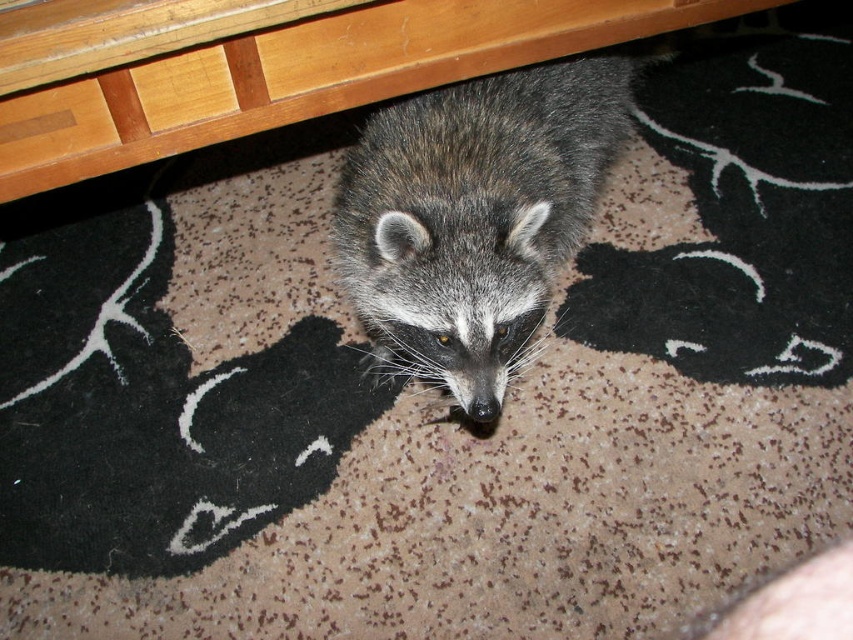
Question: Which object appears farthest from the camera in this image?

Choices:
 (A) wooden drawer at upper center
 (B) wooden drawer at upper left

Answer: (A)

Question: Based on their relative distances, which object is nearer to the fuzzy gray raccoon at center?

Choices:
 (A) wooden drawer at upper left
 (B) wooden table at upper center

Answer: (B)

Question: Can you confirm if wooden drawer at upper left is bigger than wooden drawer at upper center?

Choices:
 (A) yes
 (B) no

Answer: (A)

Question: Considering the relative positions of wooden table at upper center and wooden drawer at upper center in the image provided, where is wooden table at upper center located with respect to wooden drawer at upper center?

Choices:
 (A) below
 (B) above

Answer: (B)

Question: Is wooden table at upper center above wooden drawer at upper center?

Choices:
 (A) no
 (B) yes

Answer: (B)

Question: Which object is the farthest from the wooden drawer at upper left?

Choices:
 (A) fuzzy gray raccoon at center
 (B) wooden table at upper center
 (C) wooden drawer at upper center

Answer: (A)